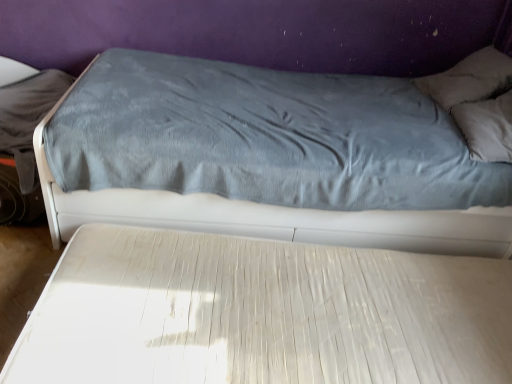
The image size is (512, 384). Find the location of `velvet blue bed at upper center, placed as the first bed when sorted from top to bottom`. velvet blue bed at upper center, placed as the first bed when sorted from top to bottom is located at coordinates (267, 213).

What is the approximate width of gray soft pillow at upper right?

14.21 inches.

Find the location of a particular element. The width and height of the screenshot is (512, 384). velvet blue bed at upper center, the 2th bed positioned from the bottom is located at coordinates (267, 213).

In terms of size, does velvet blue bed at upper center, the 2th bed positioned from the bottom, appear bigger or smaller than white textured mattress at center, which is counted as the 2th bed, starting from the top?

Considering their sizes, velvet blue bed at upper center, the 2th bed positioned from the bottom, takes up more space than white textured mattress at center, which is counted as the 2th bed, starting from the top.

Consider the image. Is velvet blue bed at upper center, the 2th bed positioned from the bottom, completely or partially outside of white textured mattress at center, the first bed from the bottom?

velvet blue bed at upper center, the 2th bed positioned from the bottom, lies outside white textured mattress at center, the first bed from the bottom,'s area.

I want to click on bed lying behind the white textured mattress at center, the first bed from the bottom, so pyautogui.click(x=267, y=213).

Does velvet blue bed at upper center, the 2th bed positioned from the bottom, touch gray soft pillow at upper right?

No, velvet blue bed at upper center, the 2th bed positioned from the bottom, is not beside gray soft pillow at upper right.

Identify the location of pillow located above the velvet blue bed at upper center, the 2th bed positioned from the bottom (from the image's perspective). This screenshot has width=512, height=384. (487, 127).

Is velvet blue bed at upper center, placed as the first bed when sorted from top to bottom, oriented towards gray soft pillow at upper right?

Yes, velvet blue bed at upper center, placed as the first bed when sorted from top to bottom, is aimed at gray soft pillow at upper right.

In the scene shown: Can we say white textured mattress at center, the first bed from the bottom, lies outside velvet blue bed at upper center, the 2th bed positioned from the bottom?

Yes.

Find the location of a particular element. The width and height of the screenshot is (512, 384). bed above the white textured mattress at center, the first bed from the bottom (from the image's perspective) is located at coordinates (267, 213).

Which is more to the right, white textured mattress at center, the first bed from the bottom, or velvet blue bed at upper center, placed as the first bed when sorted from top to bottom?

Positioned to the right is white textured mattress at center, the first bed from the bottom.

From the image's perspective, is white textured mattress at center, which is counted as the 2th bed, starting from the top, beneath gray soft pillow at upper right?

Yes, from the image's perspective, white textured mattress at center, which is counted as the 2th bed, starting from the top, is beneath gray soft pillow at upper right.

How many degrees apart are the facing directions of white textured mattress at center, the first bed from the bottom, and gray soft pillow at upper right?

white textured mattress at center, the first bed from the bottom, and gray soft pillow at upper right are facing 3.14 degrees away from each other.

Considering the sizes of objects white textured mattress at center, which is counted as the 2th bed, starting from the top, and gray soft pillow at upper right in the image provided, who is wider, white textured mattress at center, which is counted as the 2th bed, starting from the top, or gray soft pillow at upper right?

With larger width is white textured mattress at center, which is counted as the 2th bed, starting from the top.

Can you confirm if gray soft pillow at upper right is bigger than white textured mattress at center, which is counted as the 2th bed, starting from the top?

No.

Locate an element on the screen. Image resolution: width=512 pixels, height=384 pixels. pillow above the white textured mattress at center, which is counted as the 2th bed, starting from the top (from the image's perspective) is located at coordinates (487, 127).

From the picture: Considering the relative positions of gray soft pillow at upper right and white textured mattress at center, the first bed from the bottom, in the image provided, is gray soft pillow at upper right to the right of white textured mattress at center, the first bed from the bottom, from the viewer's perspective?

Correct, you'll find gray soft pillow at upper right to the right of white textured mattress at center, the first bed from the bottom.

Are gray soft pillow at upper right and white textured mattress at center, which is counted as the 2th bed, starting from the top, far apart?

That's not correct — gray soft pillow at upper right is a little close to white textured mattress at center, which is counted as the 2th bed, starting from the top.

Which object is closer to the camera taking this photo, gray soft pillow at upper right or velvet blue bed at upper center, placed as the first bed when sorted from top to bottom?

velvet blue bed at upper center, placed as the first bed when sorted from top to bottom, is closer to the camera.

Is gray soft pillow at upper right beside velvet blue bed at upper center, the 2th bed positioned from the bottom?

No, gray soft pillow at upper right is not with velvet blue bed at upper center, the 2th bed positioned from the bottom.

How many degrees apart are the facing directions of gray soft pillow at upper right and velvet blue bed at upper center, placed as the first bed when sorted from top to bottom?

gray soft pillow at upper right and velvet blue bed at upper center, placed as the first bed when sorted from top to bottom, are facing 94.7 degrees away from each other.

The width and height of the screenshot is (512, 384). What are the coordinates of `bed located in front of the velvet blue bed at upper center, the 2th bed positioned from the bottom` in the screenshot? It's located at (262, 314).

From the image's perspective, which bed is the 1st one below the gray soft pillow at upper right? Please provide its 2D coordinates.

[(267, 213)]

When comparing their distances from gray soft pillow at upper right, does velvet blue bed at upper center, placed as the first bed when sorted from top to bottom, or white textured mattress at center, the first bed from the bottom, seem further?

Among the two, white textured mattress at center, the first bed from the bottom, is located further to gray soft pillow at upper right.

Considering their positions, is velvet blue bed at upper center, placed as the first bed when sorted from top to bottom, positioned closer to white textured mattress at center, the first bed from the bottom, than gray soft pillow at upper right?

velvet blue bed at upper center, placed as the first bed when sorted from top to bottom, lies closer to white textured mattress at center, the first bed from the bottom, than the other object.

From the image, which object appears to be nearer to velvet blue bed at upper center, placed as the first bed when sorted from top to bottom, white textured mattress at center, which is counted as the 2th bed, starting from the top, or gray soft pillow at upper right?

The object closer to velvet blue bed at upper center, placed as the first bed when sorted from top to bottom, is white textured mattress at center, which is counted as the 2th bed, starting from the top.

Estimate the real-world distances between objects in this image. Which object is closer to gray soft pillow at upper right, white textured mattress at center, which is counted as the 2th bed, starting from the top, or velvet blue bed at upper center, the 2th bed positioned from the bottom?

The object closer to gray soft pillow at upper right is velvet blue bed at upper center, the 2th bed positioned from the bottom.

Which object lies nearer to the anchor point velvet blue bed at upper center, the 2th bed positioned from the bottom, gray soft pillow at upper right or white textured mattress at center, which is counted as the 2th bed, starting from the top?

Based on the image, white textured mattress at center, which is counted as the 2th bed, starting from the top, appears to be nearer to velvet blue bed at upper center, the 2th bed positioned from the bottom.

Which object lies further to the anchor point white textured mattress at center, the first bed from the bottom, gray soft pillow at upper right or velvet blue bed at upper center, the 2th bed positioned from the bottom?

gray soft pillow at upper right.

Where is `bed between velvet blue bed at upper center, placed as the first bed when sorted from top to bottom, and gray soft pillow at upper right`? This screenshot has width=512, height=384. bed between velvet blue bed at upper center, placed as the first bed when sorted from top to bottom, and gray soft pillow at upper right is located at coordinates (262, 314).